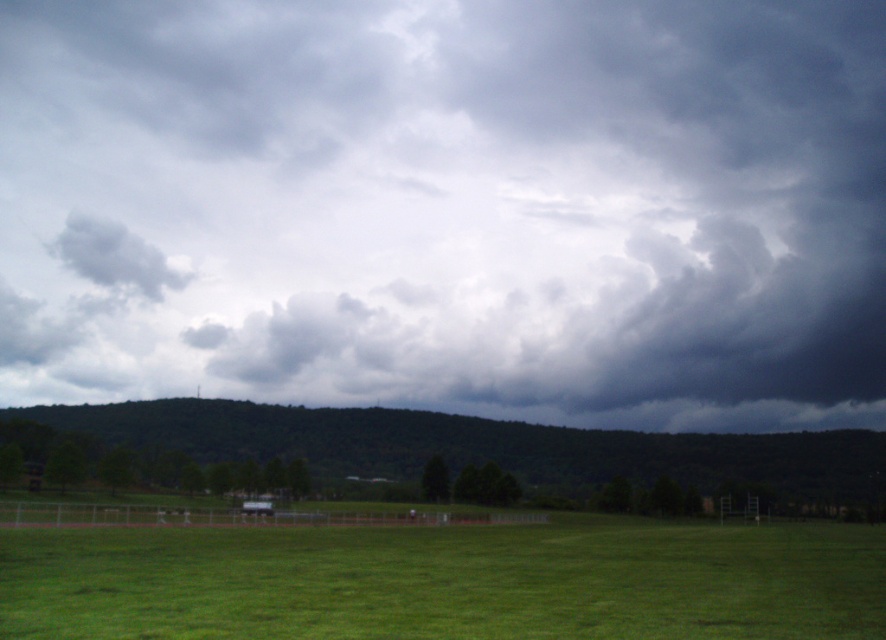
You are standing at the center of the sports field and want to take a photo of the dark gray cloud at center. Which direction should you face to capture it in the frame?

The dark gray cloud at center is located at point (x=455, y=205) in the image, which is slightly to the left and above the center. Therefore, you should face slightly to the left and upwards from the center to capture it in the frame.

From the picture: You are standing on the green grass at lower center and looking towards the gray fluffy cloud at upper left. Which object is nearer to you?

The green grass at lower center is closer to the viewer than the gray fluffy cloud at upper left.

You are planning to fly a kite in the open field. Considering the weather conditions shown in the image, which cloud, the dark gray cloud at center or the gray fluffy cloud at upper left, indicates a higher chance of rain?

The dark gray cloud at center indicates a higher chance of rain because it is larger in size compared to the gray fluffy cloud at upper left, suggesting it holds more moisture.